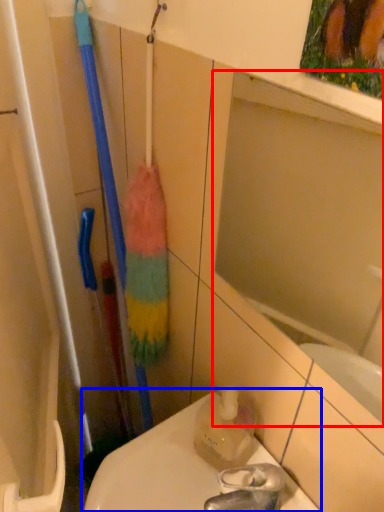
Question: Which object is closer to the camera taking this photo, mirror (highlighted by a red box) or toilet (highlighted by a blue box)?

Choices:
 (A) mirror
 (B) toilet

Answer: (A)